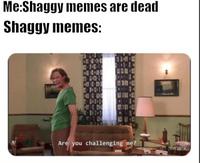
The width and height of the screenshot is (200, 163). What are the coordinates of `reflective lights` in the screenshot? It's located at (167, 70).